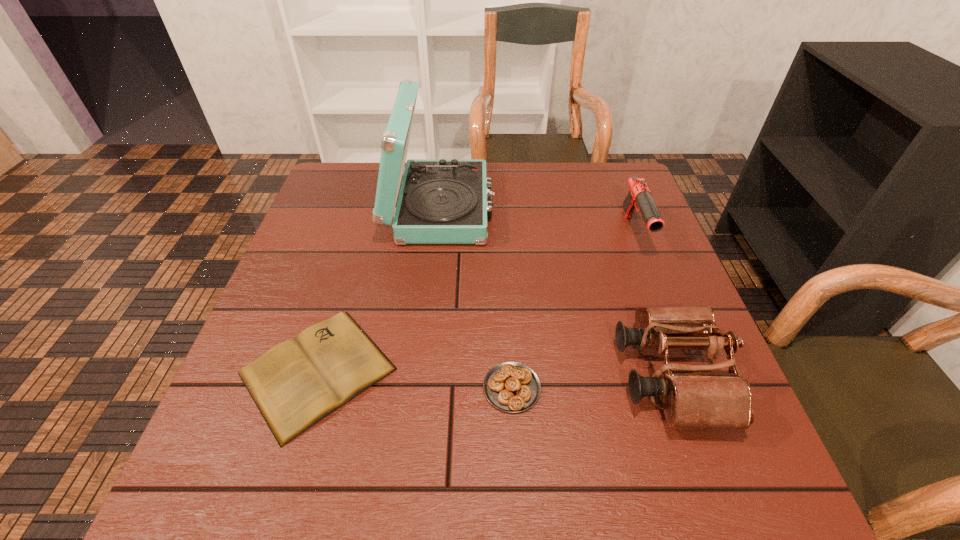
At what (x,y) coordinates should I click in order to perform the action: click on record player. Please return your answer as a coordinate pair (x, y). Image resolution: width=960 pixels, height=540 pixels. Looking at the image, I should click on (442, 201).

What are the coordinates of `gun` in the screenshot? It's located at (639, 196).

The width and height of the screenshot is (960, 540). What are the coordinates of `binoculars` in the screenshot? It's located at (692, 395).

What are the coordinates of `pastry` in the screenshot? It's located at tap(513, 387).

Find the location of a particular element. Image resolution: width=960 pixels, height=540 pixels. the shortest object is located at coordinates (295, 384).

Image resolution: width=960 pixels, height=540 pixels. Identify the location of free space located on the face side of the record player. [618, 208].

You are a GUI agent. You are given a task and a screenshot of the screen. Output one action in this format:
    pyautogui.click(x=<x>, y=<y>)
    Task: Click on the vacant space located 0.100m at the aiming end of the gun
    
    Given the screenshot: What is the action you would take?
    pyautogui.click(x=657, y=291)

This screenshot has height=540, width=960. In order to click on free region located 0.050m through the eyepieces of the binoculars in this screenshot , I will do `click(594, 376)`.

Locate an element on the screen. The width and height of the screenshot is (960, 540). free space located through the eyepieces of the binoculars is located at coordinates (494, 376).

In order to click on free spot located through the eyepieces of the binoculars in this screenshot , I will do `click(484, 376)`.